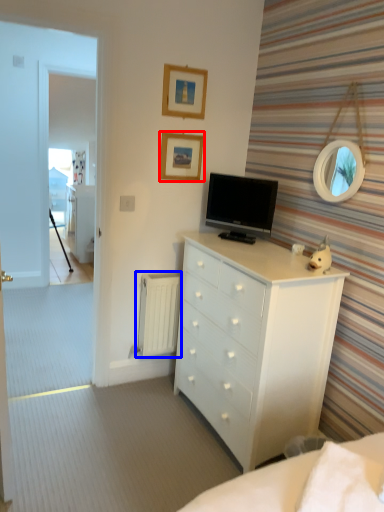
Question: Which object appears closest to the camera in this image, picture frame (highlighted by a red box) or radiator (highlighted by a blue box)?

Choices:
 (A) picture frame
 (B) radiator

Answer: (A)